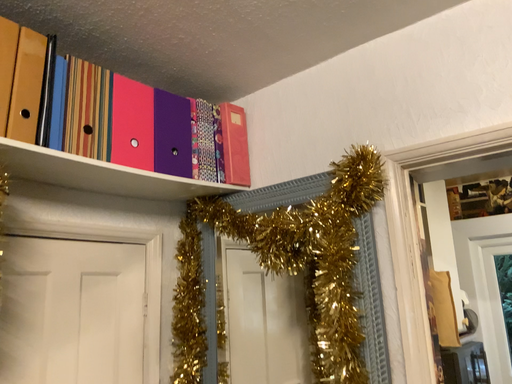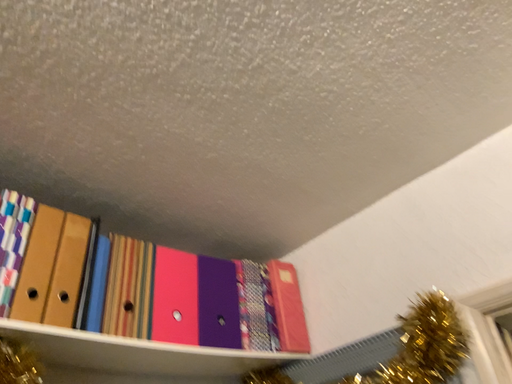
Question: Which way did the camera rotate in the video?

Choices:
 (A) rotated upward
 (B) rotated downward

Answer: (A)